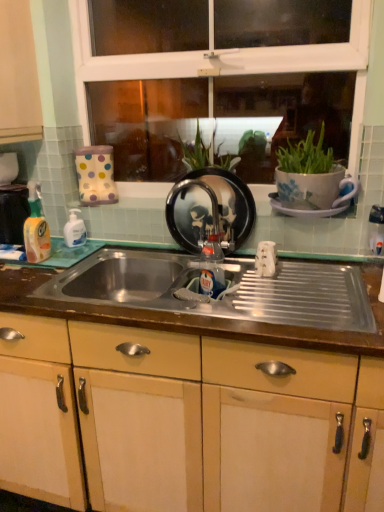
Question: Is there a large distance between white glossy bottle at left, the 2th bottle viewed from the left, and matte wood cabinet at left, the first cabinetry viewed from the top?

Choices:
 (A) no
 (B) yes

Answer: (A)

Question: Does white glossy bottle at left, the 2th bottle in the right-to-left sequence, have a greater height compared to matte wood cabinet at left, the first cabinetry viewed from the top?

Choices:
 (A) no
 (B) yes

Answer: (A)

Question: From a real-world perspective, is white glossy bottle at left, the 2th bottle viewed from the left, located beneath matte wood cabinet at left, the first cabinetry when ordered from left to right?

Choices:
 (A) yes
 (B) no

Answer: (A)

Question: Can you confirm if white glossy bottle at left, the 2th bottle in the right-to-left sequence, is positioned to the right of matte wood cabinet at left, arranged as the second cabinetry when ordered from the bottom?

Choices:
 (A) yes
 (B) no

Answer: (A)

Question: Is white glossy bottle at left, the 2th bottle viewed from the left, oriented towards matte wood cabinet at left, the first cabinetry when ordered from left to right?

Choices:
 (A) yes
 (B) no

Answer: (B)

Question: Is white glossy bottle at left, the 2th bottle in the right-to-left sequence, wider than matte wood cabinet at left, the first cabinetry when ordered from left to right?

Choices:
 (A) no
 (B) yes

Answer: (A)

Question: From the image's perspective, is matte wood cabinet at left, arranged as the second cabinetry when ordered from the bottom, located beneath white glossy bottle at left, the 2th bottle viewed from the left?

Choices:
 (A) no
 (B) yes

Answer: (A)

Question: Can you confirm if matte wood cabinet at left, arranged as the second cabinetry when ordered from the bottom, is wider than white glossy bottle at left, the 2th bottle viewed from the left?

Choices:
 (A) no
 (B) yes

Answer: (B)

Question: Is matte wood cabinet at left, the first cabinetry when ordered from left to right, placed right next to white glossy bottle at left, the 2th bottle in the right-to-left sequence?

Choices:
 (A) yes
 (B) no

Answer: (B)

Question: Could you tell me if matte wood cabinet at left, the first cabinetry when ordered from left to right, is facing white glossy bottle at left, the 2th bottle in the right-to-left sequence?

Choices:
 (A) no
 (B) yes

Answer: (A)

Question: Is matte wood cabinet at left, arranged as the second cabinetry when ordered from the bottom, surrounding white glossy bottle at left, the 2th bottle viewed from the left?

Choices:
 (A) no
 (B) yes

Answer: (A)

Question: Is matte wood cabinet at left, the first cabinetry viewed from the top, looking in the opposite direction of white glossy bottle at left, the 2th bottle viewed from the left?

Choices:
 (A) yes
 (B) no

Answer: (B)

Question: Considering the relative sizes of yellow translucent liquid at left, placed as the first bottle when sorted from left to right, and metallic stainless steel sink at center in the image provided, is yellow translucent liquid at left, placed as the first bottle when sorted from left to right, thinner than metallic stainless steel sink at center?

Choices:
 (A) yes
 (B) no

Answer: (A)